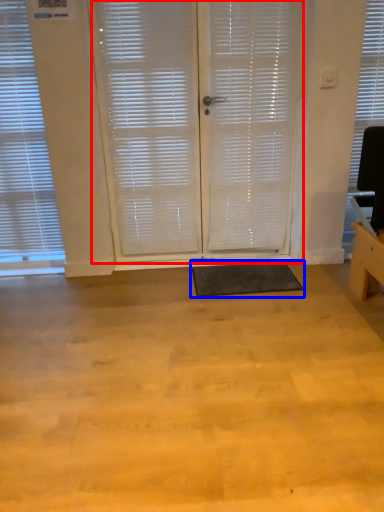
Question: Which object is closer to the camera taking this photo, screen door (highlighted by a red box) or yoga mat (highlighted by a blue box)?

Choices:
 (A) screen door
 (B) yoga mat

Answer: (A)